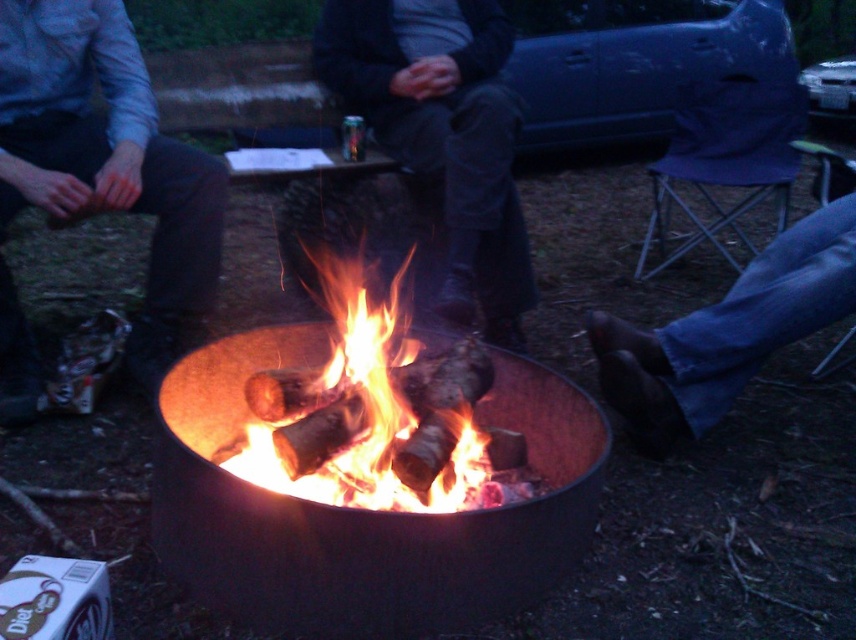
Does point (447, 593) come behind point (455, 276)?

No, it is in front of (455, 276).

Describe the element at coordinates (364, 509) in the screenshot. Image resolution: width=856 pixels, height=640 pixels. I see `black metal fire pit at center` at that location.

What do you see at coordinates (364, 509) in the screenshot? This screenshot has width=856, height=640. I see `black metal fire pit at center` at bounding box center [364, 509].

What are the coordinates of `black metal fire pit at center` in the screenshot? It's located at (364, 509).

Does point (421, 604) lie in front of point (837, 211)?

That is True.

From the picture: Can you confirm if black metal fire pit at center is thinner than blue denim jeans at lower right?

In fact, black metal fire pit at center might be wider than blue denim jeans at lower right.

Image resolution: width=856 pixels, height=640 pixels. I want to click on black metal fire pit at center, so click(364, 509).

At what (x,y) coordinates should I click in order to perform the action: click on black metal fire pit at center. Please return your answer as a coordinate pair (x, y). The height and width of the screenshot is (640, 856). Looking at the image, I should click on (364, 509).

Is black metal fire pit at center behind bright orange flames at center?

That is False.

Does point (432, 625) come in front of point (366, 472)?

Yes, it is in front of point (366, 472).

Based on the photo, who is more distant from viewer, (331,572) or (459,406)?

Positioned behind is point (459,406).

Find the location of a particular element. black metal fire pit at center is located at coordinates (364, 509).